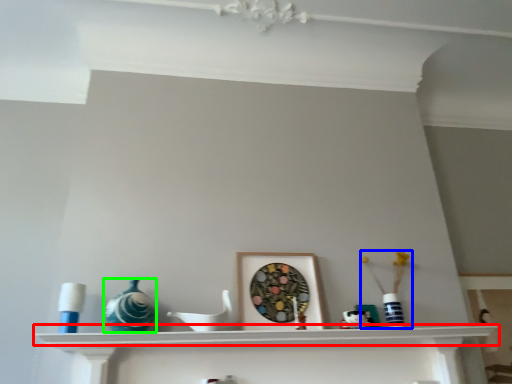
Question: Which object is positioned closest to shelf (highlighted by a red box)? Select from toy (highlighted by a blue box) and glass vase (highlighted by a green box).

Choices:
 (A) toy
 (B) glass vase

Answer: (B)